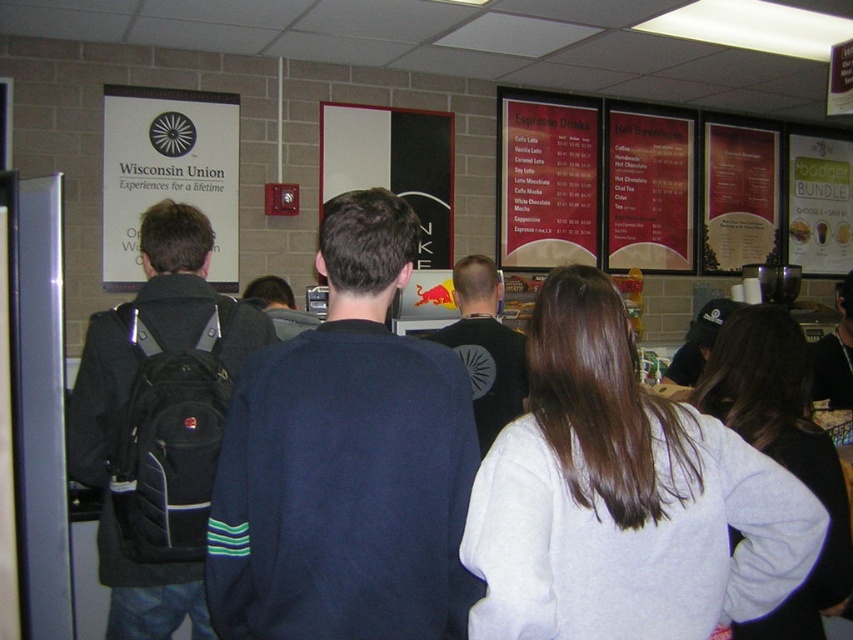
Looking at this image, you are a person standing behind the dark blue sweater at center and the gray fleece sweatshirt at center in the food service area. Which of the two people in front of you is taller?

The dark blue sweater at center is taller than the gray fleece sweatshirt at center.

You are a food service worker standing at the counter. You need to hand a meal to the person wearing the dark blue sweater at center and then to the person wearing the gray fleece sweatshirt at center. How much distance do you need to move forward to reach the second person after serving the first?

The distance between dark blue sweater at center and gray fleece sweatshirt at center is 33.09 inches, so you need to move forward 33.09 inches to reach the second person after serving the first.